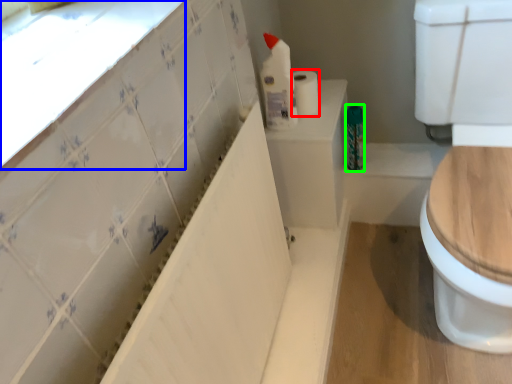
Question: Which is nearer to the toilet paper (highlighted by a red box)? window sill (highlighted by a blue box) or toiletry (highlighted by a green box).

Choices:
 (A) window sill
 (B) toiletry

Answer: (B)